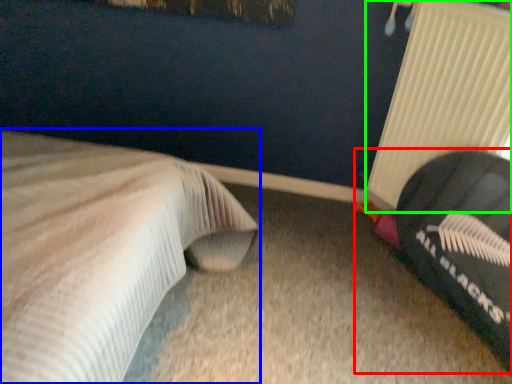
Question: Which object is the farthest from bean bag chair (highlighted by a red box)? Choose among these: bed (highlighted by a blue box) or radiator (highlighted by a green box).

Choices:
 (A) bed
 (B) radiator

Answer: (A)